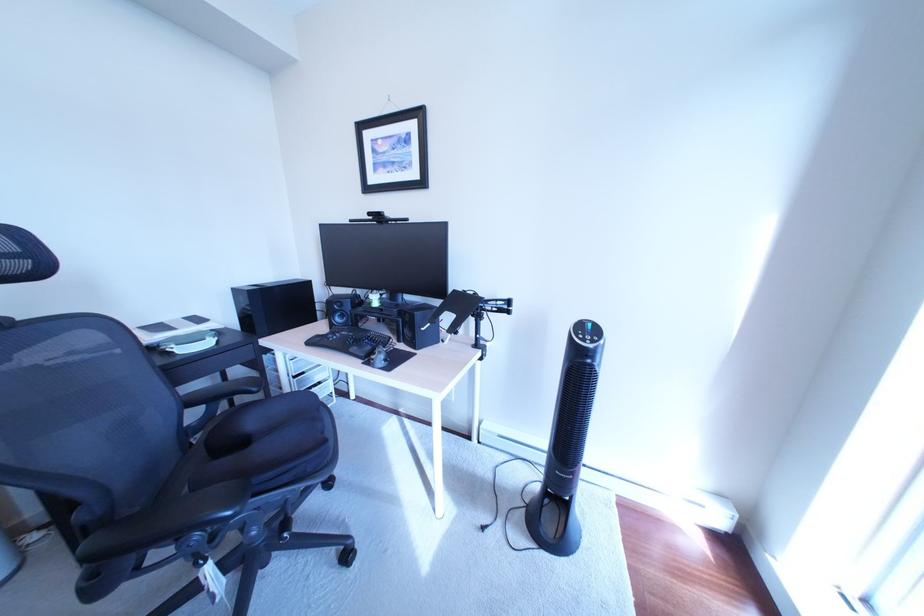
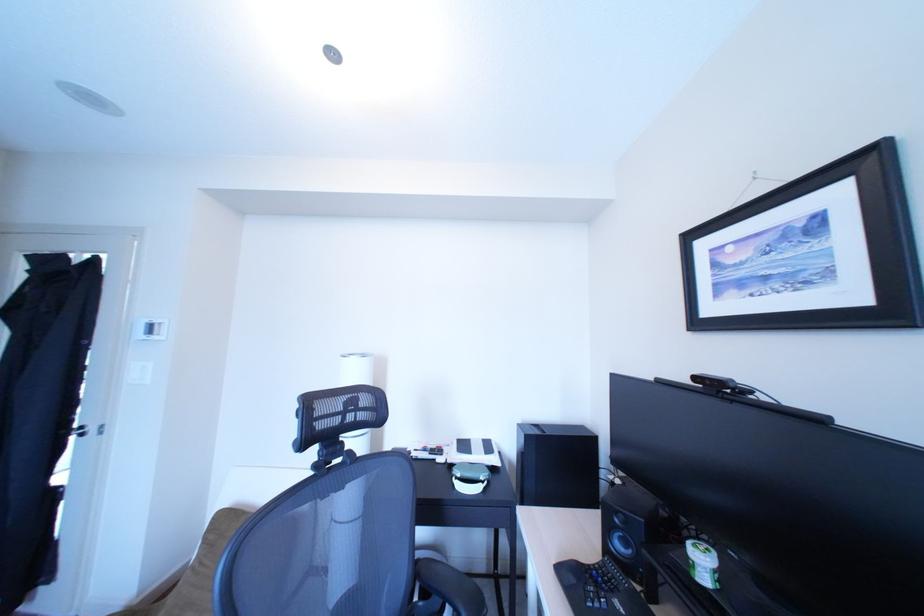
Question: The camera is either moving clockwise (left) or counter-clockwise (right) around the object. The first image is from the beginning of the video and the second image is from the end. Is the camera moving left or right when shooting the video?

Choices:
 (A) Left
 (B) Right

Answer: (B)